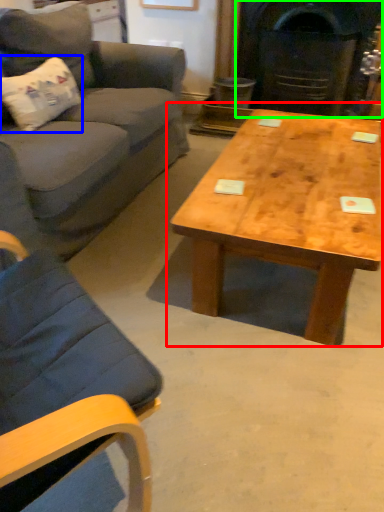
Question: Which object is positioned farthest from coffee table (highlighted by a red box)? Select from pillow (highlighted by a blue box) and fireplace (highlighted by a green box).

Choices:
 (A) pillow
 (B) fireplace

Answer: (B)